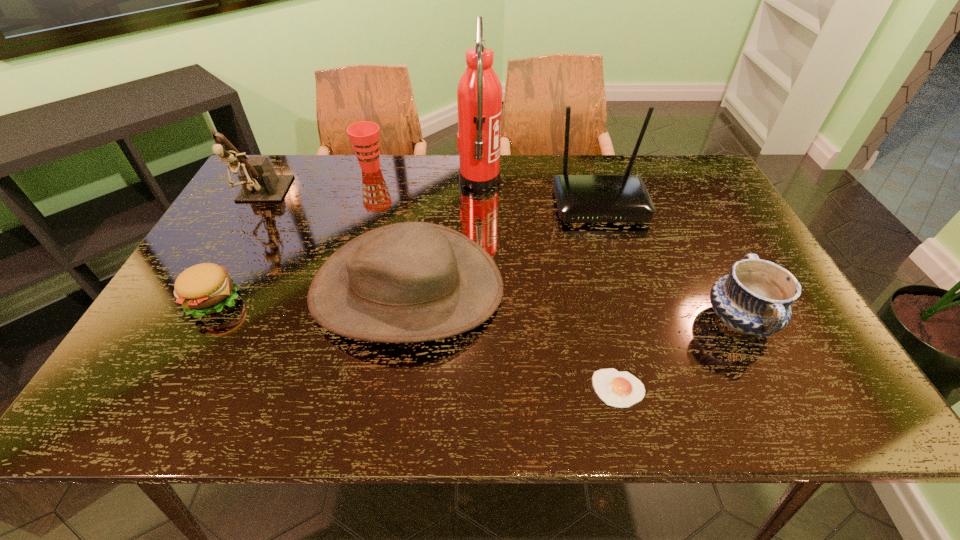
At what (x,y) coordinates should I click in order to perform the action: click on cup positioned at the far edge. Please return your answer as a coordinate pair (x, y). The height and width of the screenshot is (540, 960). Looking at the image, I should click on (364, 136).

Locate an element on the screen. Image resolution: width=960 pixels, height=540 pixels. object present at the near edge is located at coordinates (618, 389).

Identify the location of figurine located at the left edge. [x=260, y=183].

Where is `hamburger that is positioned at the left edge`? hamburger that is positioned at the left edge is located at coordinates (206, 288).

In order to click on object that is at the right edge in this screenshot , I will do `click(755, 298)`.

Locate an element on the screen. This screenshot has height=540, width=960. object at the far left corner is located at coordinates (260, 183).

The height and width of the screenshot is (540, 960). Identify the location of vacant region at the far edge of the desktop. (517, 193).

I want to click on free location at the near edge, so click(x=748, y=387).

You are a GUI agent. You are given a task and a screenshot of the screen. Output one action in this format:
    pyautogui.click(x=<x>, y=<y>)
    Task: Click on the vacant area at the left edge
    
    Given the screenshot: What is the action you would take?
    (x=195, y=357)

Where is `free location at the right edge of the desktop`? free location at the right edge of the desktop is located at coordinates (752, 354).